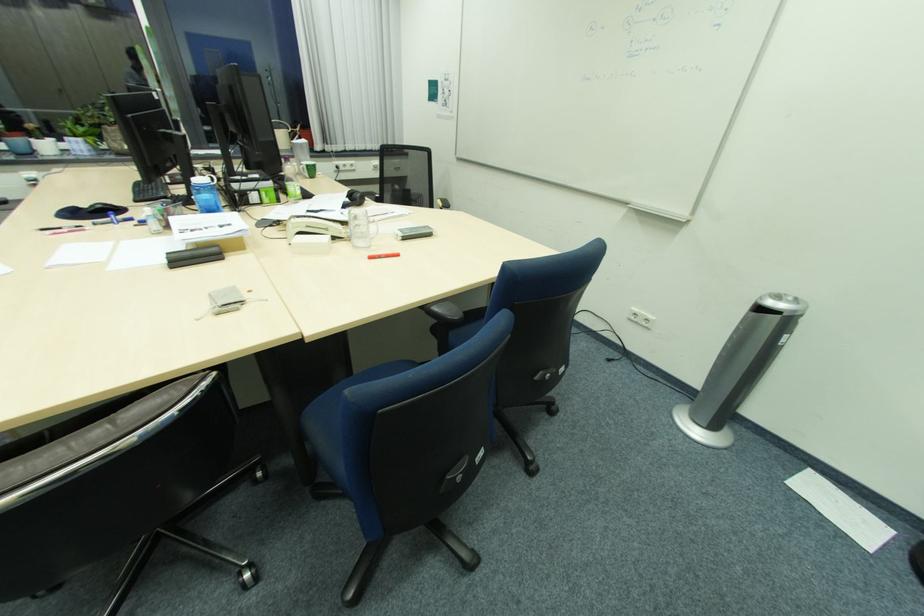
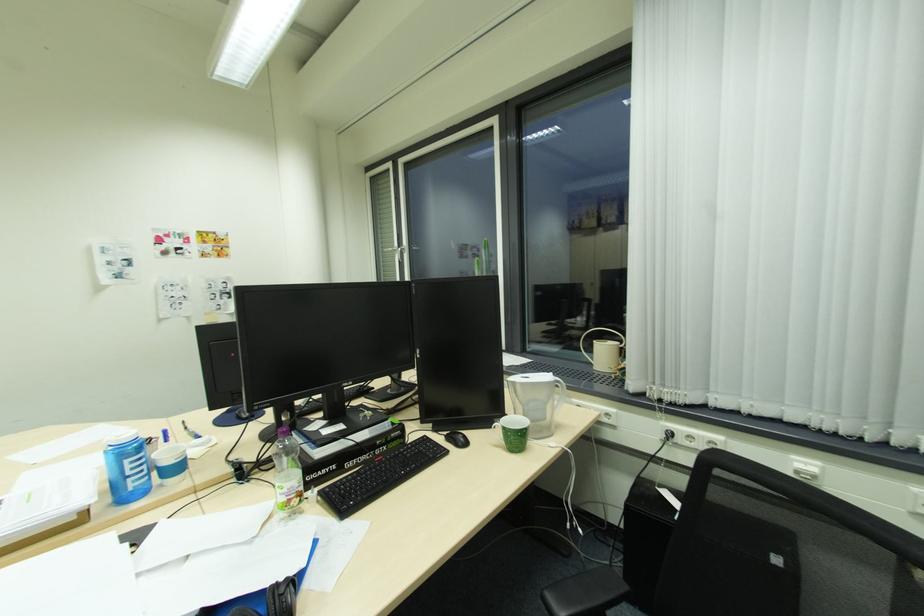
Where in the second image is the point corresponding to the point at 304,185 from the first image?

(286, 485)